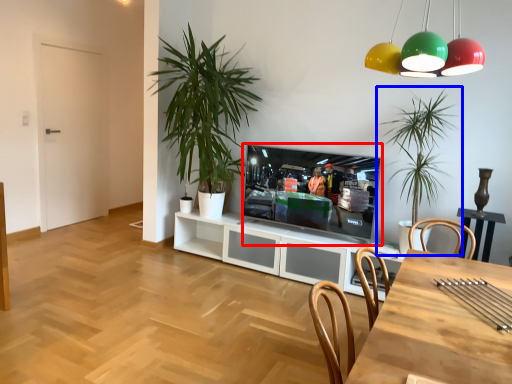
Question: Which object appears closest to the camera in this image, television (highlighted by a red box) or houseplant (highlighted by a blue box)?

Choices:
 (A) television
 (B) houseplant

Answer: (B)